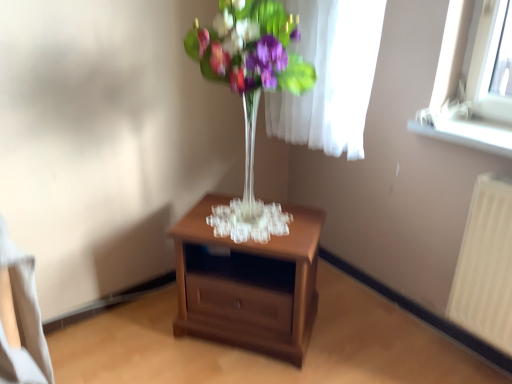
The width and height of the screenshot is (512, 384). What do you see at coordinates (486, 265) in the screenshot?
I see `white plastic radiator at right` at bounding box center [486, 265].

You are a GUI agent. You are given a task and a screenshot of the screen. Output one action in this format:
    pyautogui.click(x=<x>, y=<y>)
    Task: Click on the clear glass vase at center
    Image resolution: width=512 pixels, height=384 pixels.
    Given the screenshot: What is the action you would take?
    pyautogui.click(x=250, y=93)

How distant is white plastic window sill at upper right from clear glass vase at center?

A distance of 26.32 inches exists between white plastic window sill at upper right and clear glass vase at center.

From a real-world perspective, who is located higher, white plastic window sill at upper right or clear glass vase at center?

clear glass vase at center, from a real-world perspective.

Would you consider white plastic window sill at upper right to be distant from clear glass vase at center?

white plastic window sill at upper right is near clear glass vase at center, not far away.

What's the angular difference between white plastic window sill at upper right and clear glass vase at center's facing directions?

The angle between the facing direction of white plastic window sill at upper right and the facing direction of clear glass vase at center is 35.4 degrees.

Does brown wooden nightstand at center have a smaller size compared to white plastic radiator at right?

Actually, brown wooden nightstand at center might be larger than white plastic radiator at right.

In the scene shown: Which is farther from the camera, (308,286) or (471,326)?

The point (308,286) is more distant.

Is white plastic radiator at right located within brown wooden nightstand at center?

No, white plastic radiator at right is located outside of brown wooden nightstand at center.

Considering their positions, is brown wooden nightstand at center located in front of or behind white plastic radiator at right?

Visually, brown wooden nightstand at center is located behind white plastic radiator at right.

Can you see clear glass vase at center touching white plastic window sill at upper right?

No, clear glass vase at center is not beside white plastic window sill at upper right.

Between clear glass vase at center and white plastic window sill at upper right, which one has more height?

clear glass vase at center.

Is clear glass vase at center wider or thinner than white plastic window sill at upper right?

In the image, clear glass vase at center appears to be wider than white plastic window sill at upper right.

Which object is further away from the camera taking this photo, clear glass vase at center or white plastic window sill at upper right?

white plastic window sill at upper right.

I want to click on radiator beneath the white plastic window sill at upper right (from a real-world perspective), so click(x=486, y=265).

Who is bigger, white plastic radiator at right or white plastic window sill at upper right?

white plastic radiator at right is bigger.

Is white plastic radiator at right positioned with its back to white plastic window sill at upper right?

white plastic radiator at right does not have its back to white plastic window sill at upper right.

Which object is positioned more to the left, white plastic radiator at right or white plastic window sill at upper right?

white plastic window sill at upper right is more to the left.

Considering the sizes of objects white plastic radiator at right and clear glass vase at center in the image provided, who is wider, white plastic radiator at right or clear glass vase at center?

With larger width is clear glass vase at center.

Can you confirm if white plastic radiator at right is positioned to the right of clear glass vase at center?

Yes, white plastic radiator at right is to the right of clear glass vase at center.

Relative to clear glass vase at center, is white plastic radiator at right in front or behind?

In the image, white plastic radiator at right appears behind clear glass vase at center.

Who is shorter, white plastic radiator at right or clear glass vase at center?

white plastic radiator at right is shorter.

Is brown wooden nightstand at center positioned beyond the bounds of white plastic window sill at upper right?

That's correct, brown wooden nightstand at center is outside of white plastic window sill at upper right.

Considering the sizes of objects brown wooden nightstand at center and white plastic window sill at upper right in the image provided, who is taller, brown wooden nightstand at center or white plastic window sill at upper right?

brown wooden nightstand at center is taller.

Find the location of a particular element. This screenshot has width=512, height=384. window sill located on the right of brown wooden nightstand at center is located at coordinates (464, 132).

Which of these two, white plastic radiator at right or brown wooden nightstand at center, stands shorter?

Standing shorter between the two is brown wooden nightstand at center.

Is white plastic radiator at right facing towards brown wooden nightstand at center?

No.

I want to click on radiator on the right of brown wooden nightstand at center, so click(486, 265).

Identify the location of floral arrangement on the left of white plastic window sill at upper right. (250, 93).

What are the coordinates of `radiator located above the brown wooden nightstand at center (from a real-world perspective)` in the screenshot? It's located at (486, 265).

Considering their positions, is white plastic window sill at upper right positioned closer to brown wooden nightstand at center than white plastic radiator at right?

white plastic radiator at right is positioned closer to the anchor brown wooden nightstand at center.

Which object lies nearer to the anchor point white plastic window sill at upper right, brown wooden nightstand at center or white plastic radiator at right?

white plastic radiator at right.

When comparing their distances from white plastic window sill at upper right, does clear glass vase at center or brown wooden nightstand at center seem closer?

Among the two, clear glass vase at center is located nearer to white plastic window sill at upper right.

Which object lies nearer to the anchor point white plastic window sill at upper right, clear glass vase at center or white plastic radiator at right?

white plastic radiator at right is closer to white plastic window sill at upper right.

Which object lies nearer to the anchor point white plastic radiator at right, brown wooden nightstand at center or clear glass vase at center?

brown wooden nightstand at center lies closer to white plastic radiator at right than the other object.

When comparing their distances from brown wooden nightstand at center, does white plastic radiator at right or white plastic window sill at upper right seem further?

Among the two, white plastic window sill at upper right is located further to brown wooden nightstand at center.

Considering their positions, is white plastic window sill at upper right positioned closer to clear glass vase at center than white plastic radiator at right?

white plastic window sill at upper right is positioned closer to the anchor clear glass vase at center.

Based on the photo, from the image, which object appears to be nearer to clear glass vase at center, white plastic window sill at upper right or brown wooden nightstand at center?

brown wooden nightstand at center lies closer to clear glass vase at center than the other object.

You are a GUI agent. You are given a task and a screenshot of the screen. Output one action in this format:
    pyautogui.click(x=<x>, y=<y>)
    Task: Click on the nightstand between clear glass vase at center and white plastic radiator at right in the horizontal direction
    This screenshot has height=384, width=512.
    Given the screenshot: What is the action you would take?
    pyautogui.click(x=248, y=283)

Where is `nightstand between clear glass vase at center and white plastic window sill at upper right`? This screenshot has width=512, height=384. nightstand between clear glass vase at center and white plastic window sill at upper right is located at coordinates (248, 283).

Where is `window sill located between clear glass vase at center and white plastic radiator at right in the left-right direction`? window sill located between clear glass vase at center and white plastic radiator at right in the left-right direction is located at coordinates point(464,132).

What are the coordinates of `window sill situated between brown wooden nightstand at center and white plastic radiator at right from left to right` in the screenshot? It's located at click(464, 132).